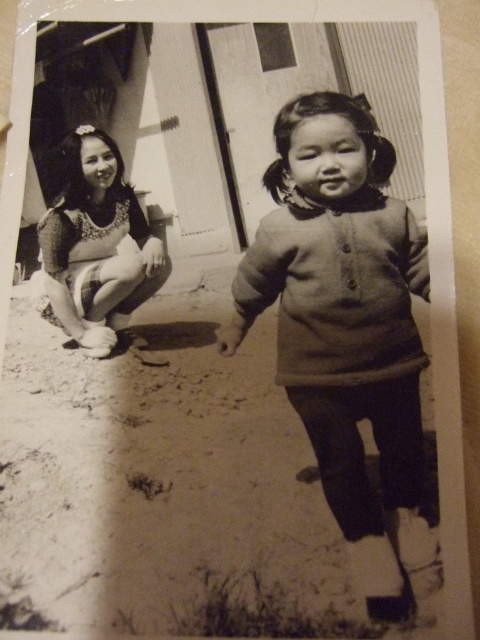
Question: Does dull sand at lower center have a larger size compared to matte gray sweater at center?

Choices:
 (A) yes
 (B) no

Answer: (A)

Question: Among these objects, which one is farthest from the camera?

Choices:
 (A) dull sand at lower center
 (B) matte gray sweater at center

Answer: (B)

Question: Can you confirm if matte gray sweater at center is smaller than matte floral dress at left?

Choices:
 (A) no
 (B) yes

Answer: (A)

Question: Which object is farther from the camera taking this photo?

Choices:
 (A) matte floral dress at left
 (B) dull sand at lower center
 (C) matte gray sweater at center

Answer: (A)

Question: Can you confirm if matte gray sweater at center is smaller than matte floral dress at left?

Choices:
 (A) yes
 (B) no

Answer: (B)

Question: Which of the following is the closest to the observer?

Choices:
 (A) (63, 435)
 (B) (60, 264)
 (C) (324, 474)

Answer: (C)